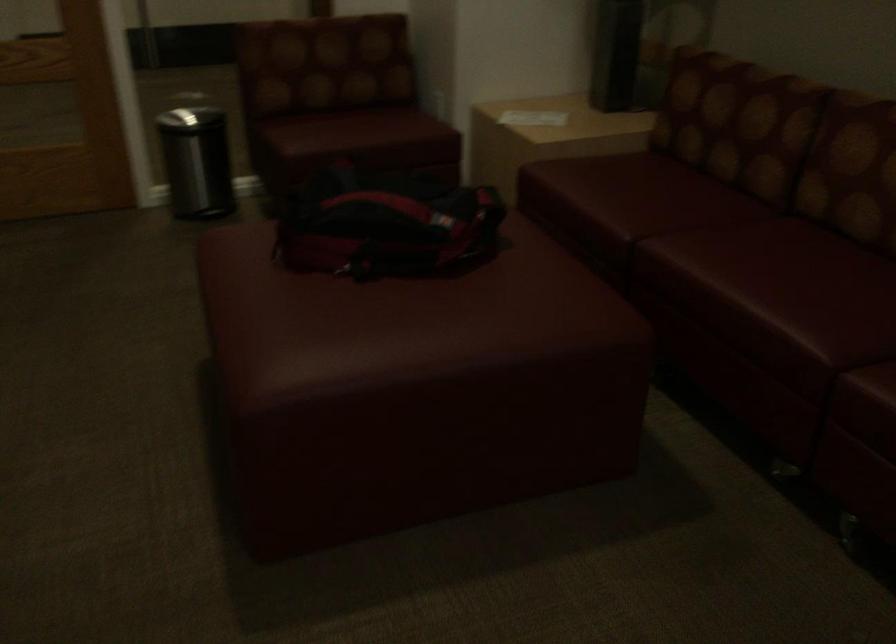
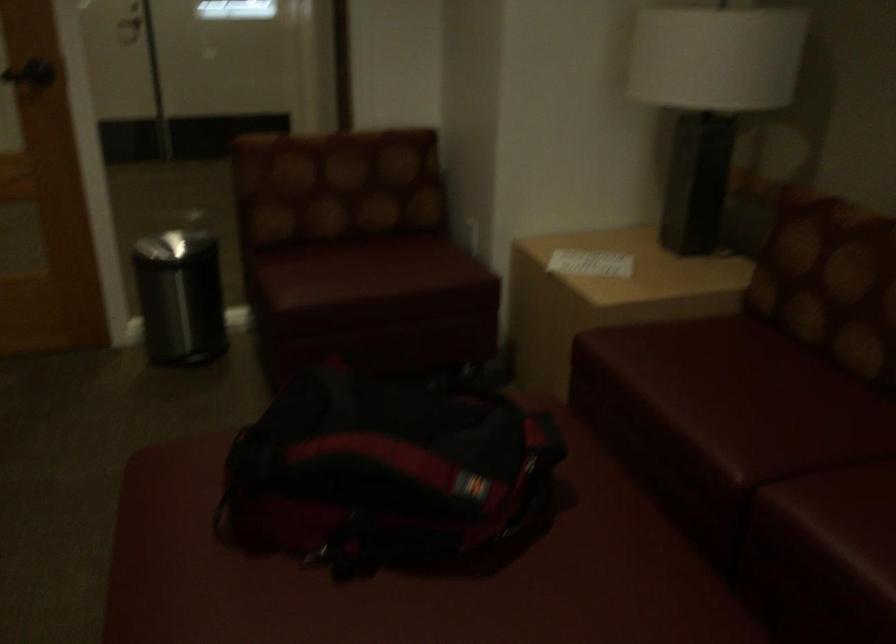
Question: The images are taken continuously from a first-person perspective. In which direction is your viewpoint rotating?

Choices:
 (A) Left
 (B) Right
 (C) Up
 (D) Down

Answer: (C)